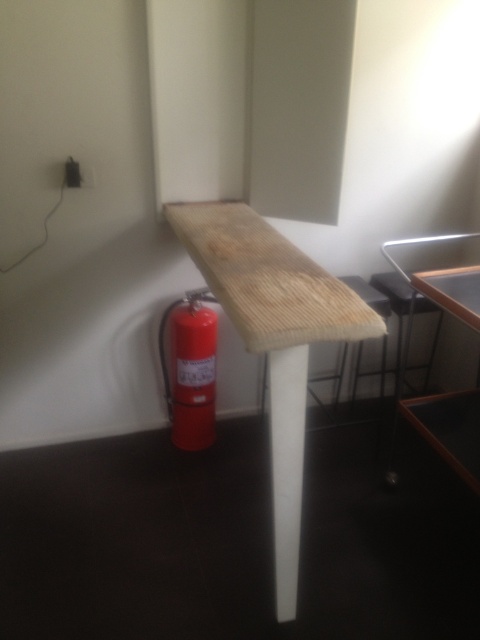
Question: Observing the image, what is the correct spatial positioning of natural wood table at center in reference to red metallic fire extinguisher at lower left?

Choices:
 (A) below
 (B) above

Answer: (B)

Question: Which point is closer to the camera taking this photo?

Choices:
 (A) (212, 326)
 (B) (287, 586)

Answer: (B)

Question: Which object is farther from the camera taking this photo?

Choices:
 (A) natural wood table at center
 (B) red metallic fire extinguisher at lower left

Answer: (B)

Question: In this image, where is natural wood table at center located relative to red metallic fire extinguisher at lower left?

Choices:
 (A) left
 (B) right

Answer: (B)

Question: Can you confirm if natural wood table at center is positioned below red metallic fire extinguisher at lower left?

Choices:
 (A) no
 (B) yes

Answer: (A)